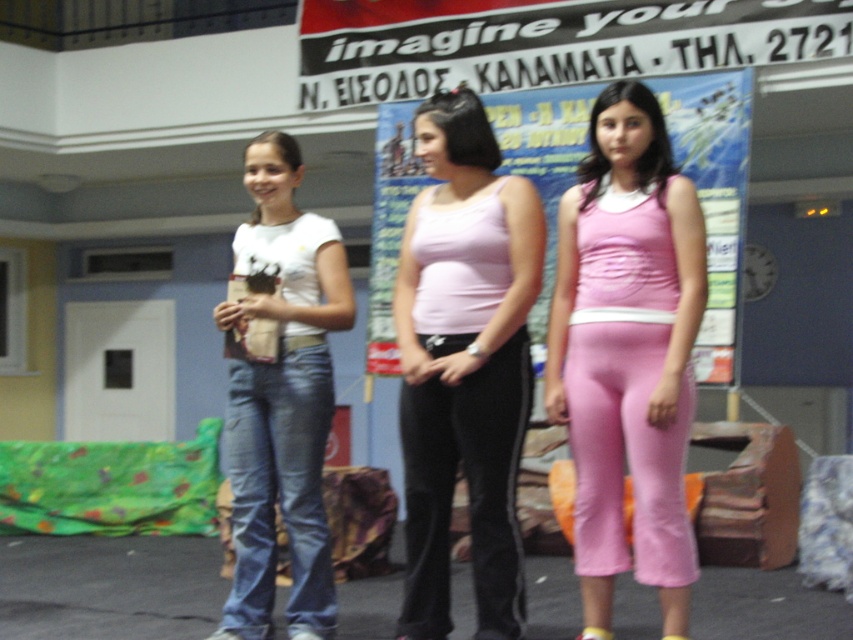
Based on the photo, you are a photographer who needs to capture a photo of the blue denim jeans at left and the pink fabric poster at center. Can you position yourself so that the poster is visible above the jeans in the frame?

The pink fabric poster at center is located above the blue denim jeans at left, so yes, you can position yourself to capture the poster above the jeans in the frame.

You are a costume designer preparing for a performance. You have to decide which item to adjust first based on the description. Which item is shorter between the pink fabric tank top at center and the denim jeans at center?

The pink fabric tank top at center is shorter than the denim jeans at center, so you should adjust the pink fabric tank top at center first to ensure proper length.

You are standing in the room where the three people are. You want to move from the point at coordinates point (x=407, y=451) to the point at coordinates point (x=682, y=108). Is the path between them clear of any obstacles?

The path between point (x=407, y=451) and point (x=682, y=108) is clear of any obstacles since the scene only shows three individuals standing on the stage or platform and no objects blocking the path between the two points.